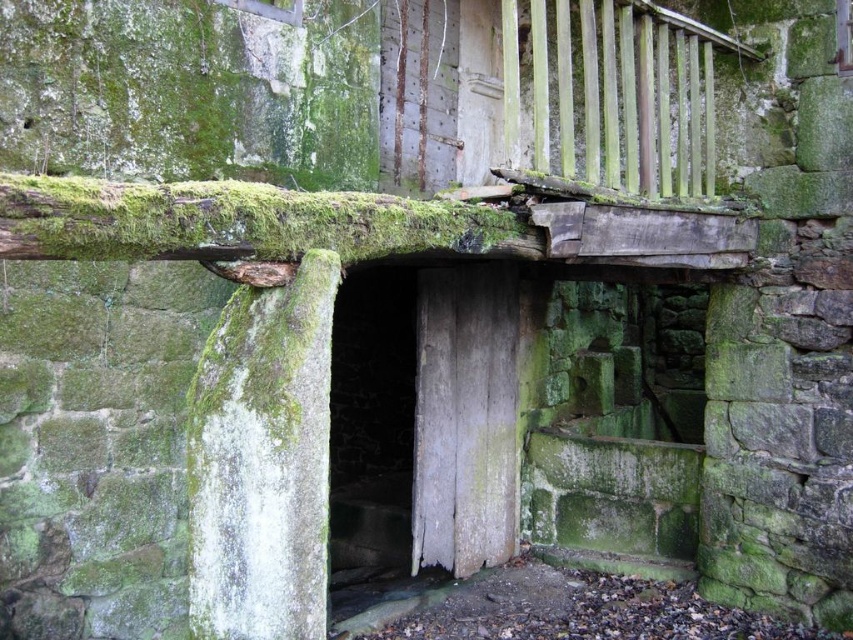
Question: Is green mossy log at upper center positioned behind weathered wood door at center?

Choices:
 (A) no
 (B) yes

Answer: (A)

Question: Which point is farther to the camera?

Choices:
 (A) (488, 404)
 (B) (546, 138)
 (C) (231, 227)

Answer: (A)

Question: Does green wooden rail at upper right have a lesser width compared to green mossy log at upper center?

Choices:
 (A) no
 (B) yes

Answer: (A)

Question: Does green wooden rail at upper right appear on the right side of green mossy log at upper center?

Choices:
 (A) no
 (B) yes

Answer: (B)

Question: Which of the following is the closest to the observer?

Choices:
 (A) (688, 40)
 (B) (19, 218)

Answer: (B)

Question: Which point is farther from the camera taking this photo?

Choices:
 (A) (635, 32)
 (B) (465, 496)

Answer: (B)